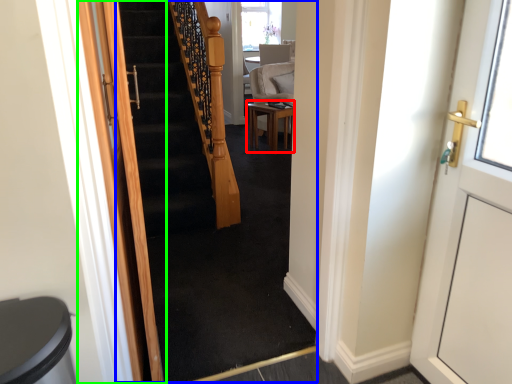
Question: Based on their relative distances, which object is farther from table (highlighted by a red box)? Choose from escalator (highlighted by a blue box) and door (highlighted by a green box).

Choices:
 (A) escalator
 (B) door

Answer: (B)